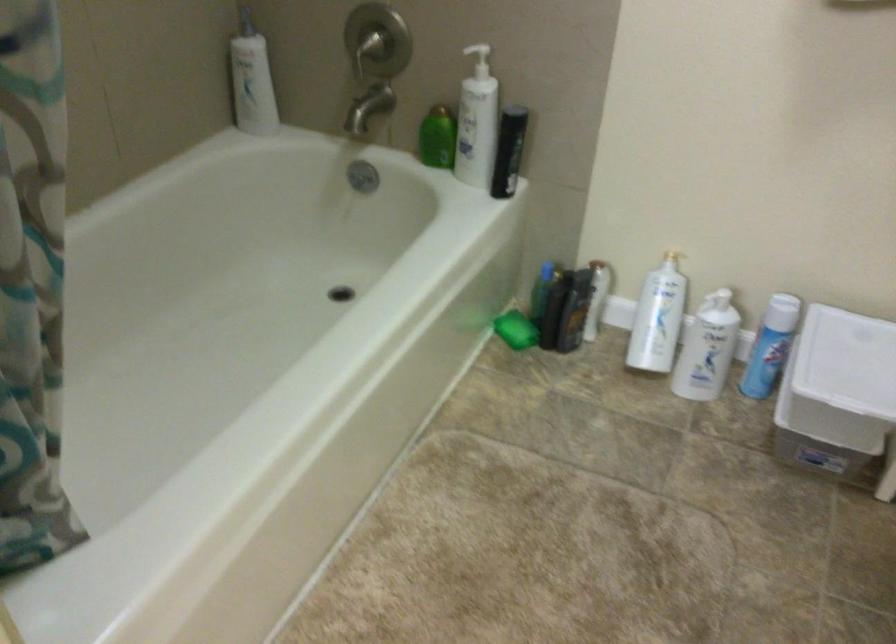
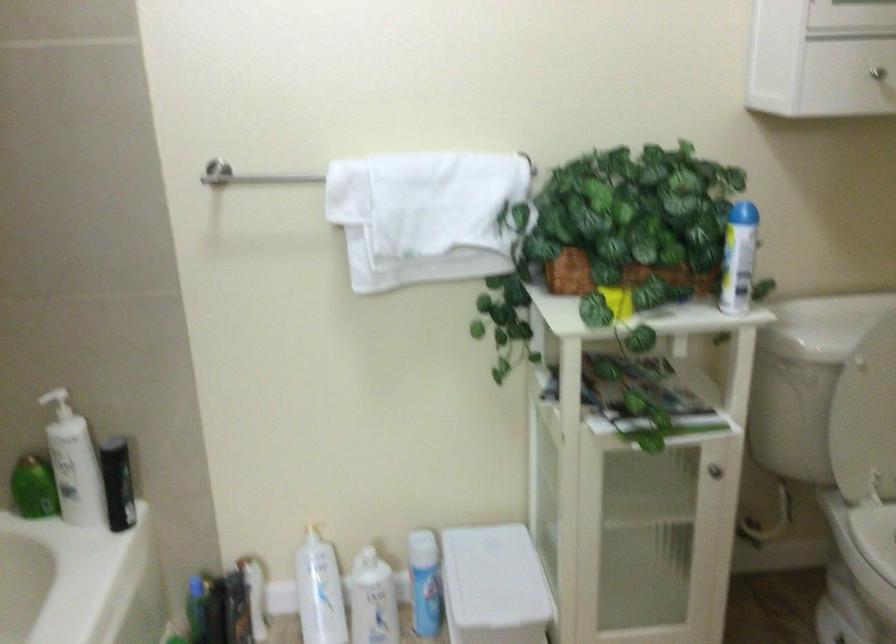
Locate, in the second image, the point that corresponds to pixel 667 249 in the first image.

(306, 523)